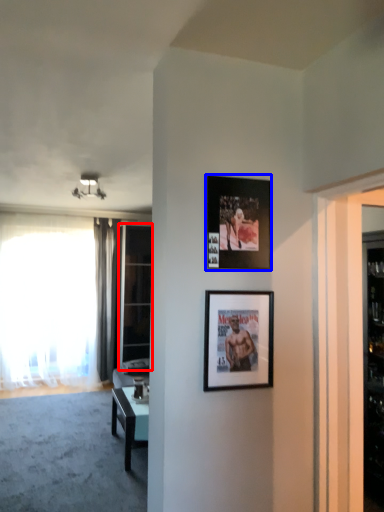
Question: Which object appears closest to the camera in this image, glass door (highlighted by a red box) or picture frame (highlighted by a blue box)?

Choices:
 (A) glass door
 (B) picture frame

Answer: (B)